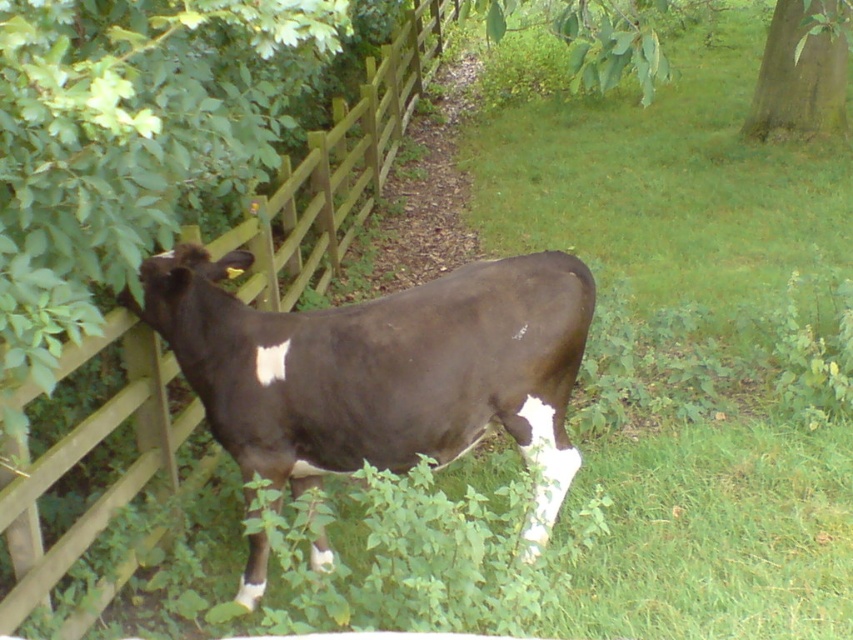
Can you confirm if dark brown cow at center is bigger than wooden at left?

Actually, dark brown cow at center might be smaller than wooden at left.

Who is more distant from viewer, (212, 358) or (397, 52)?

Point (397, 52)

Describe the element at coordinates (381, 368) in the screenshot. The image size is (853, 640). I see `dark brown cow at center` at that location.

Find the location of `dark brown cow at center`. dark brown cow at center is located at coordinates [x=381, y=368].

Is point (222, 252) farther from camera compared to point (814, 33)?

Yes, it is behind point (814, 33).

Can you confirm if wooden at left is positioned to the left of green rough bark tree at upper right?

Yes, wooden at left is to the left of green rough bark tree at upper right.

Is point (322, 266) farther from viewer compared to point (833, 67)?

No, (322, 266) is closer to viewer.

This screenshot has width=853, height=640. What are the coordinates of `wooden at left` in the screenshot? It's located at (338, 170).

Is the position of dark brown cow at center less distant than that of green rough bark tree at upper right?

Yes, it is.

Can you confirm if dark brown cow at center is bigger than green rough bark tree at upper right?

Correct, dark brown cow at center is larger in size than green rough bark tree at upper right.

Where is `dark brown cow at center`? This screenshot has height=640, width=853. dark brown cow at center is located at coordinates (381, 368).